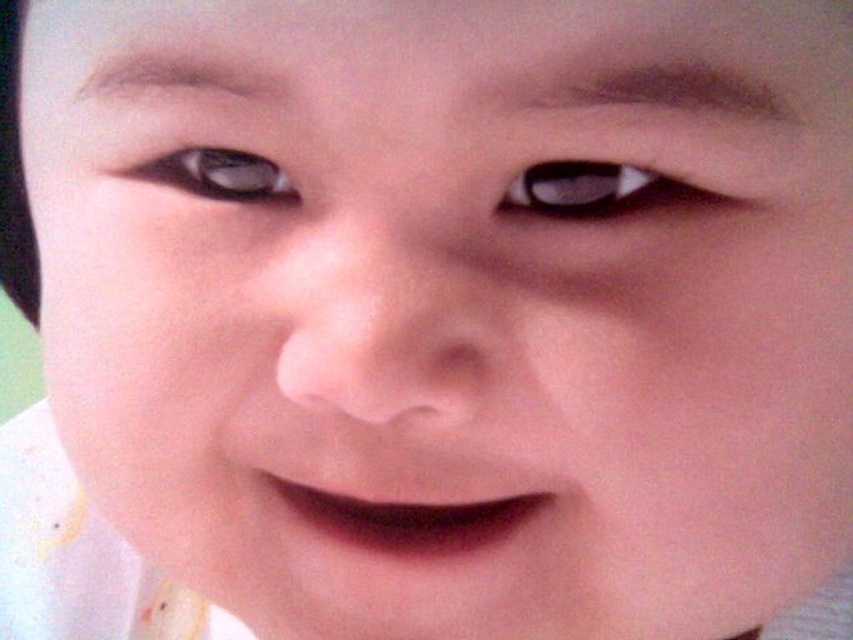
Is point (732, 198) farther from camera compared to point (262, 172)?

No, it is not.

Is point (566, 186) in front of point (262, 161)?

Yes, point (566, 186) is closer to viewer.

Between point (570, 172) and point (192, 164), which one is positioned behind?

Positioned behind is point (192, 164).

Where is `matte black eye at upper center`? The width and height of the screenshot is (853, 640). matte black eye at upper center is located at coordinates click(598, 189).